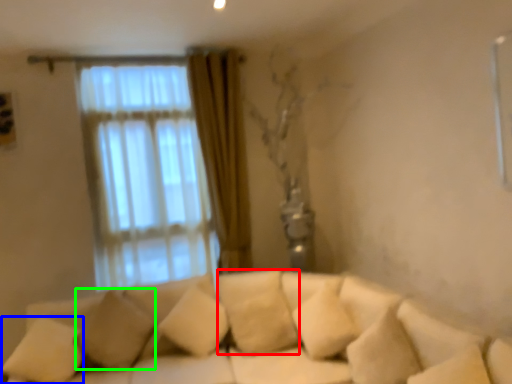
Question: Considering the real-world distances, which object is farthest from pillow (highlighted by a red box)? pillow (highlighted by a blue box) or pillow (highlighted by a green box)?

Choices:
 (A) pillow
 (B) pillow

Answer: (A)